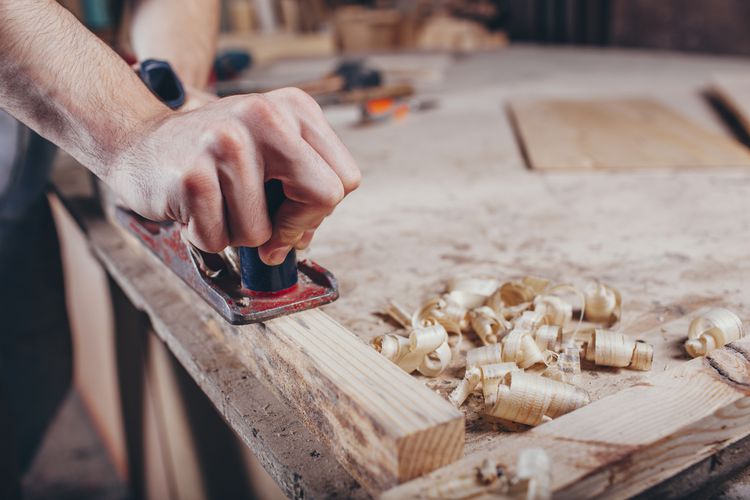
Where is `wall`? This screenshot has width=750, height=500. wall is located at coordinates (136, 425).